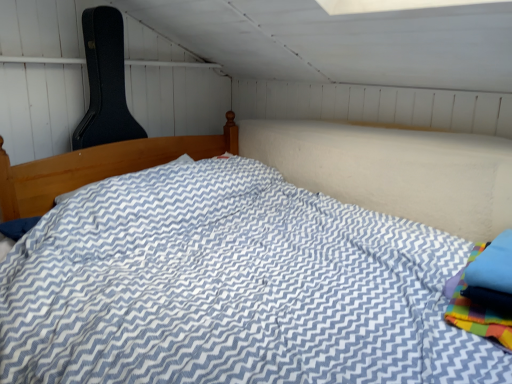
Where is `blue fabric at lower right`? blue fabric at lower right is located at coordinates (476, 309).

What do you see at coordinates (476, 309) in the screenshot?
I see `blue fabric at lower right` at bounding box center [476, 309].

Find the location of a particular element. The width and height of the screenshot is (512, 384). blue fabric at lower right is located at coordinates click(476, 309).